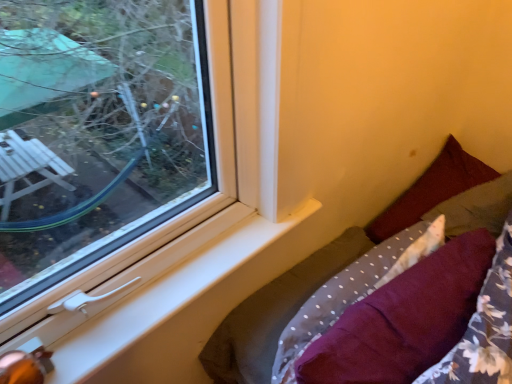
This screenshot has width=512, height=384. Find the location of `vacant space situated above white plastic window sill at lower left (from a real-world perspective)`. vacant space situated above white plastic window sill at lower left (from a real-world perspective) is located at coordinates (189, 270).